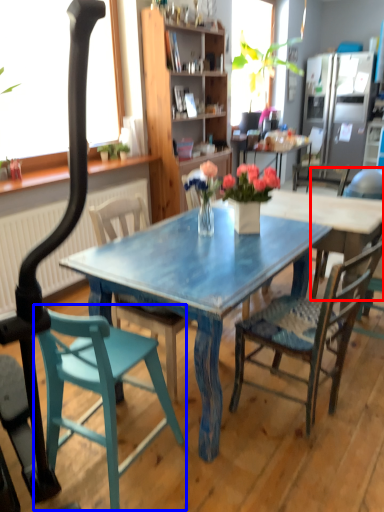
Question: Which point is closer to the camera, chair (highlighted by a red box) or chair (highlighted by a blue box)?

Choices:
 (A) chair
 (B) chair

Answer: (B)